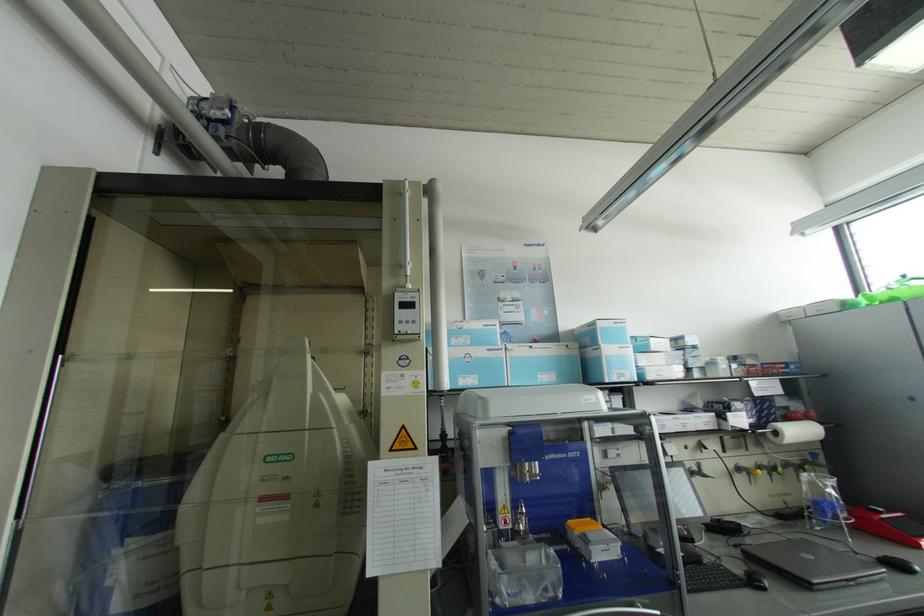
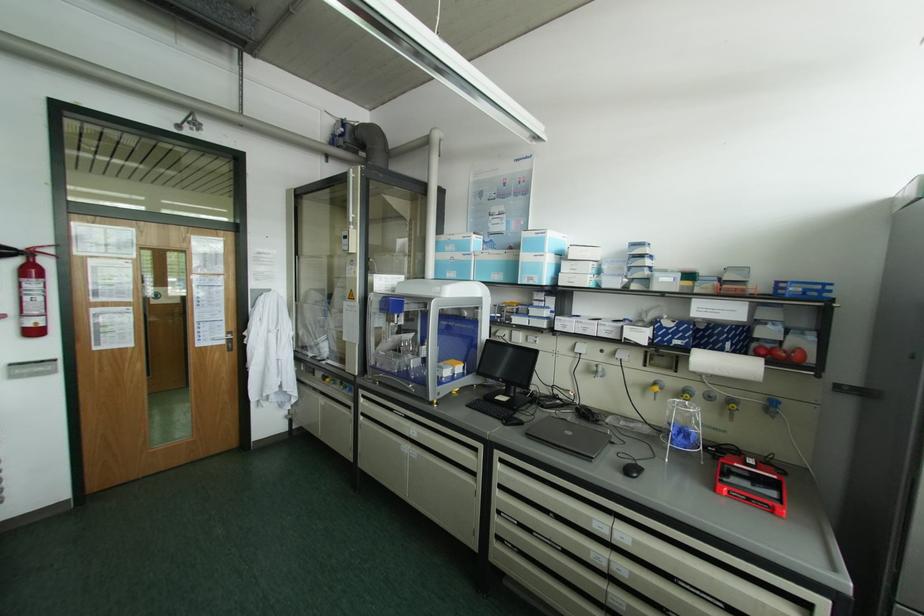
Find the pixel in the second image that matches point 480,352 in the first image.

(457, 256)